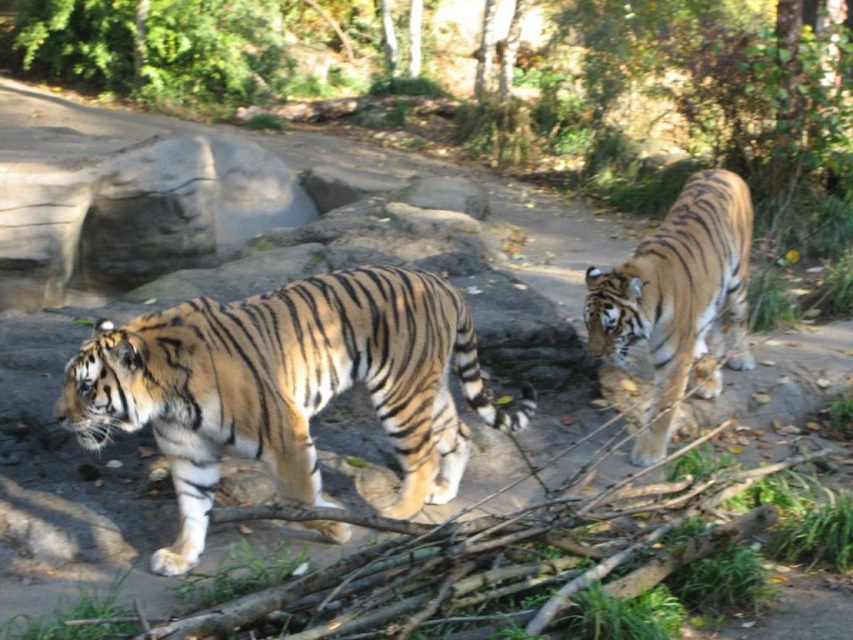
You are standing at the origin point of the coordinate system in the zoo enclosure. The orange brown striped tiger at left is located at point (287, 387). If you want to approach the tiger without getting too close, which direction should you move in to stay behind it?

To stay behind the orange brown striped tiger at left located at point (287, 387), you should move in the direction opposite to where it is facing. Since the tigers are moving from left to right across the frame, the tiger at left is facing towards the right. Therefore, to stay behind it, you should position yourself to its left side, which would be the direction towards the lower coordinate values along the x and y axes.